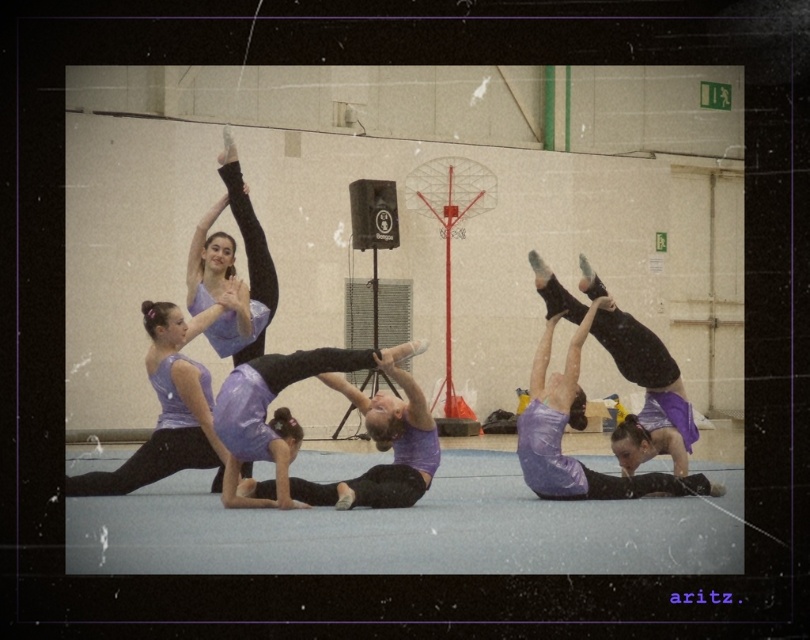
Is purple matte gymnast at center closer to camera compared to matte purple leotard at right?

Yes, it is in front of matte purple leotard at right.

Measure the distance from purple matte gymnast at center to matte purple leotard at right.

The distance of purple matte gymnast at center from matte purple leotard at right is 4.03 meters.

Who is more distant from viewer, (254, 381) or (664, 372)?

The point (664, 372) is more distant.

Identify the location of purple matte gymnast at center. The width and height of the screenshot is (810, 640). (269, 403).

Describe the element at coordinates (167, 410) in the screenshot. I see `purple matte leggings at center` at that location.

Which is behind, point (167, 472) or point (241, 212)?

The point (167, 472) is more distant.

Is point (190, 408) behind point (227, 355)?

No, (190, 408) is in front of (227, 355).

Image resolution: width=810 pixels, height=640 pixels. I want to click on purple matte leggings at center, so click(167, 410).

Between purple matte leggings at center and purple matte gymnast at center, which one appears on the right side from the viewer's perspective?

From the viewer's perspective, purple matte gymnast at center appears more on the right side.

Is purple matte leggings at center positioned at the back of purple matte gymnast at center?

Yes, it is behind purple matte gymnast at center.

Does point (169, 364) lie behind point (259, 449)?

Yes, it is behind point (259, 449).

This screenshot has width=810, height=640. Identify the location of purple matte leggings at center. (167, 410).